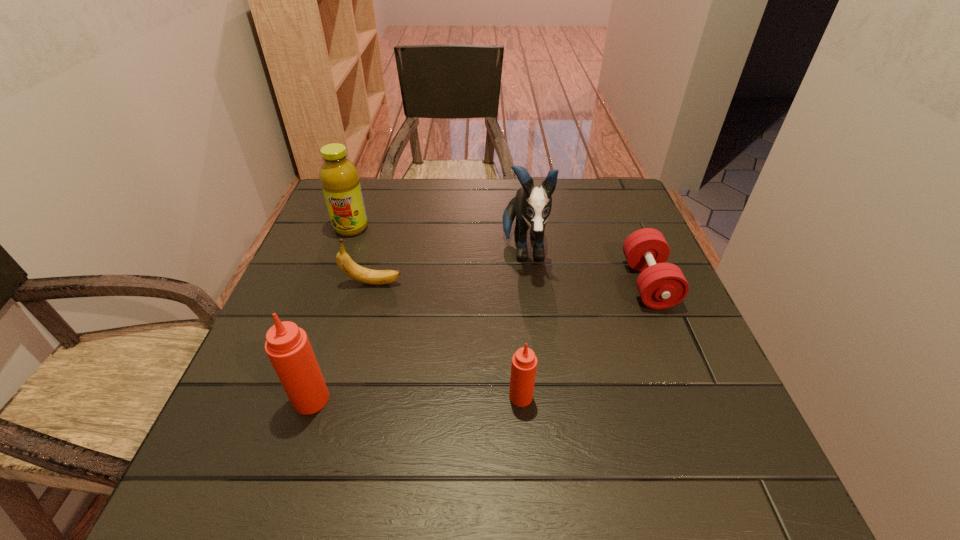
Locate an element on the screen. The height and width of the screenshot is (540, 960). free space between the puppy and the dumbbell is located at coordinates (586, 267).

This screenshot has width=960, height=540. What are the coordinates of `empty space that is in between the shorter Tabasco sauce and the fruit juice` in the screenshot? It's located at (436, 312).

At what (x,y) coordinates should I click in order to perform the action: click on vacant area that lies between the puppy and the shorter Tabasco sauce. Please return your answer as a coordinate pair (x, y). The height and width of the screenshot is (540, 960). Looking at the image, I should click on (522, 323).

The image size is (960, 540). Find the location of `free space between the taller Tabasco sauce and the fruit juice`. free space between the taller Tabasco sauce and the fruit juice is located at coordinates (331, 314).

At what (x,y) coordinates should I click in order to perform the action: click on unoccupied area between the right Tabasco sauce and the left Tabasco sauce. Please return your answer as a coordinate pair (x, y). The image size is (960, 540). Looking at the image, I should click on (416, 398).

The image size is (960, 540). What are the coordinates of `vacant space in between the taller Tabasco sauce and the fruit juice` in the screenshot? It's located at (331, 314).

This screenshot has width=960, height=540. Find the location of `vacant area that lies between the fruit juice and the banana`. vacant area that lies between the fruit juice and the banana is located at coordinates (362, 255).

The image size is (960, 540). Find the location of `object that stands as the fifth closest to the banana`. object that stands as the fifth closest to the banana is located at coordinates (661, 285).

This screenshot has width=960, height=540. Identify the location of object that is the third nearest to the fruit juice. (288, 348).

At what (x,y) coordinates should I click in order to perform the action: click on free space that satisfies the following two spatial constraints: 1. on the front label of the fruit juice; 2. on the right side of the left Tabasco sauce. Please return your answer as a coordinate pair (x, y). Image resolution: width=960 pixels, height=540 pixels. Looking at the image, I should click on (288, 399).